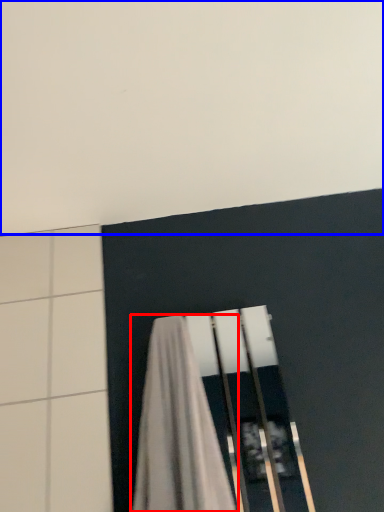
Question: Which object appears closest to the camera in this image, curtain (highlighted by a red box) or backdrop (highlighted by a blue box)?

Choices:
 (A) curtain
 (B) backdrop

Answer: (B)